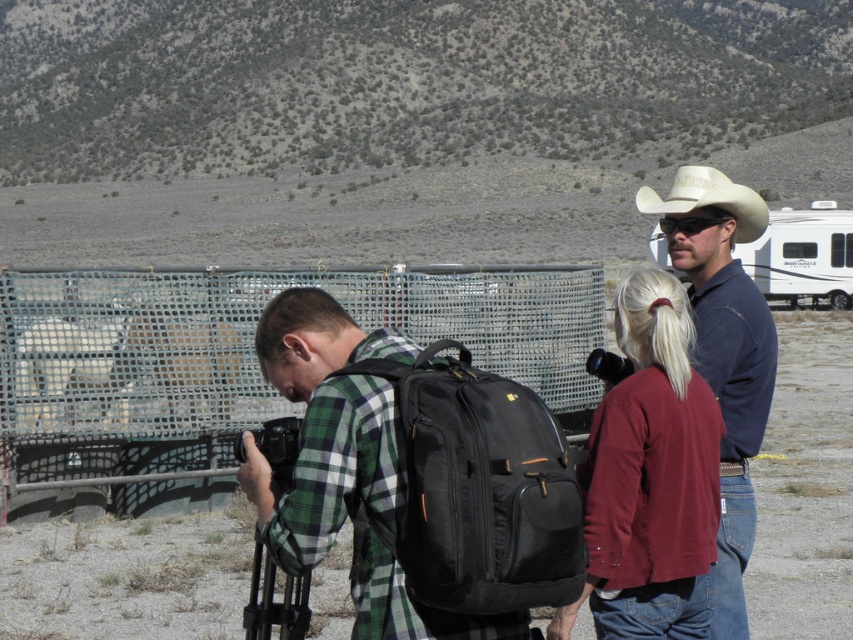
Question: Can you confirm if metal mesh fence at center is thinner than white leather cowboy hat at upper right?

Choices:
 (A) yes
 (B) no

Answer: (A)

Question: Among these objects, which one is farthest from the camera?

Choices:
 (A) white plastic recreational vehicle at upper right
 (B) matte blue shirt at center

Answer: (A)

Question: Which point is closer to the camera taking this photo?

Choices:
 (A) (474, 572)
 (B) (640, 208)

Answer: (A)

Question: Does metal mesh fence at center appear over white plastic recreational vehicle at upper right?

Choices:
 (A) no
 (B) yes

Answer: (A)

Question: Which of the following is the closest to the observer?

Choices:
 (A) (683, 260)
 (B) (204, 380)
 (C) (531, 500)
 (D) (836, 227)

Answer: (C)

Question: Considering the relative positions of metal mesh fence at center and matte blue shirt at center in the image provided, where is metal mesh fence at center located with respect to matte blue shirt at center?

Choices:
 (A) left
 (B) right

Answer: (A)